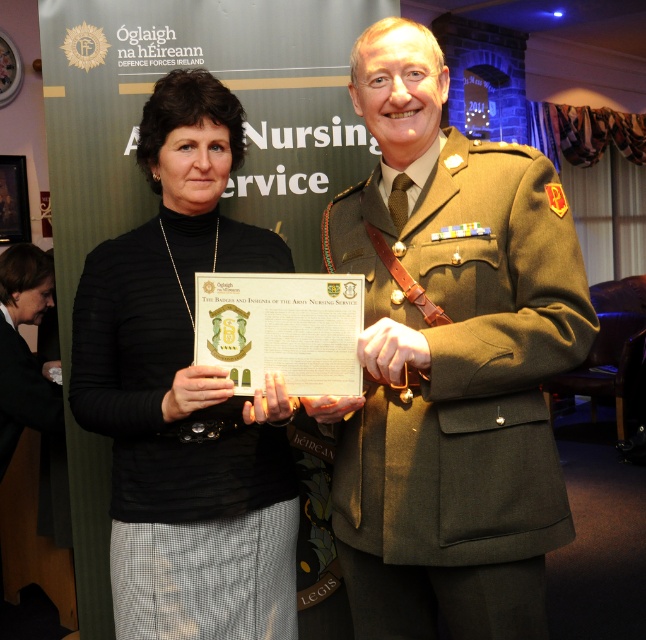
Is matte olive-green uniform at center positioned at the back of black matte card at center?

That is False.

Consider the image. How far apart are matte olive-green uniform at center and black matte card at center?

34.70 centimeters

Is point (526, 364) positioned after point (284, 474)?

No, it is not.

You are a GUI agent. You are given a task and a screenshot of the screen. Output one action in this format:
    pyautogui.click(x=<x>, y=<y>)
    Task: Click on the matte olive-green uniform at center
    Image resolution: width=646 pixels, height=640 pixels.
    Given the screenshot: What is the action you would take?
    pyautogui.click(x=450, y=362)